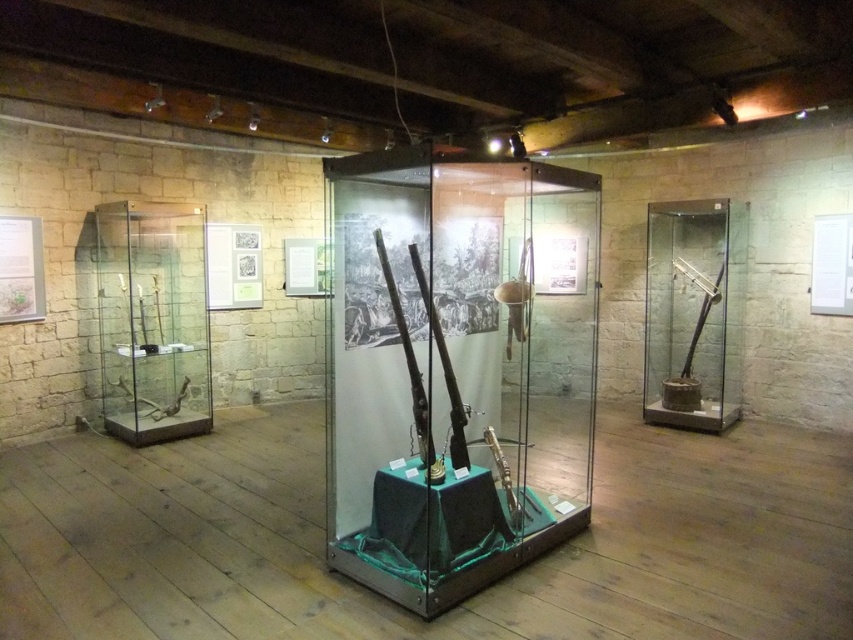
Can you confirm if metallic gun at center is positioned to the left of matte glass display case at left?

No, metallic gun at center is not to the left of matte glass display case at left.

The width and height of the screenshot is (853, 640). Describe the element at coordinates (386, 600) in the screenshot. I see `metallic gun at center` at that location.

The image size is (853, 640). What are the coordinates of `metallic gun at center` in the screenshot? It's located at (386, 600).

Can you confirm if metallic gun at center is thinner than clear glass case at center?

No.

Between metallic gun at center and clear glass case at center, which one has less height?

Standing shorter between the two is metallic gun at center.

This screenshot has height=640, width=853. Describe the element at coordinates (386, 600) in the screenshot. I see `metallic gun at center` at that location.

At what (x,y) coordinates should I click in order to perform the action: click on metallic gun at center. Please return your answer as a coordinate pair (x, y). The image size is (853, 640). Looking at the image, I should click on (386, 600).

Can you confirm if matte glass display case at left is positioned above matte black rifle at right?

No.

Is point (129, 216) closer to viewer compared to point (685, 355)?

Yes.

Where is `matte glass display case at left`? matte glass display case at left is located at coordinates (152, 321).